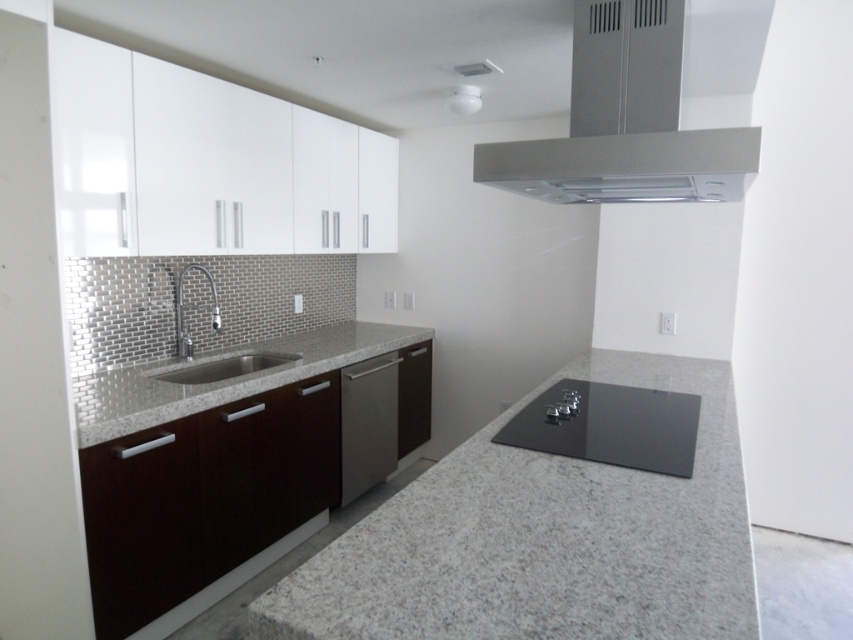
Question: Estimate the real-world distances between objects in this image. Which object is closer to the satin silver sink at center?

Choices:
 (A) stainless steel sink at center
 (B) gray granite countertop at left

Answer: (A)

Question: Which object is farther from the camera taking this photo?

Choices:
 (A) satin stainless steel dishwasher at center
 (B) gray granite countertop at left

Answer: (A)

Question: Is satin stainless steel dishwasher at center positioned in front of chrome metallic faucet at left?

Choices:
 (A) yes
 (B) no

Answer: (B)

Question: Can you confirm if satin stainless steel dishwasher at center is bigger than chrome metallic faucet at left?

Choices:
 (A) yes
 (B) no

Answer: (A)

Question: Which point is farther to the camera?

Choices:
 (A) satin silver metallic exhaust hood at upper center
 (B) satin silver sink at center

Answer: (B)

Question: Does gray granite countertop at left have a greater width compared to black glass cooktop at center?

Choices:
 (A) yes
 (B) no

Answer: (A)